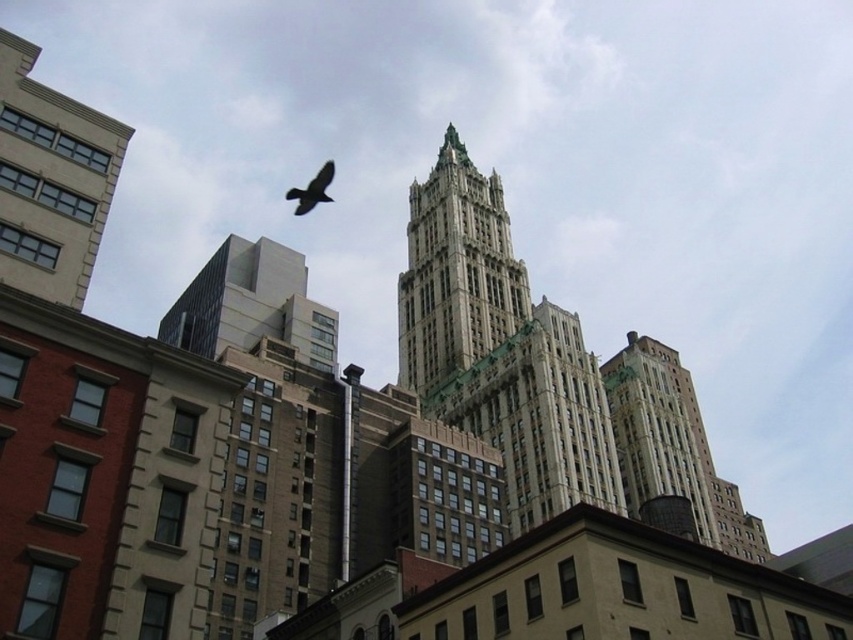
Question: Which point is farther from the camera taking this photo?

Choices:
 (A) (289, 189)
 (B) (431, 250)
 (C) (20, 241)

Answer: (A)

Question: Which object is farther from the camera taking this photo?

Choices:
 (A) beige stone building at left
 (B) gray concrete building at upper left
 (C) gray stone tower at center
 (D) shiny black bird at upper center

Answer: (D)

Question: Is beige stone building at left bigger than gray concrete building at upper left?

Choices:
 (A) yes
 (B) no

Answer: (B)

Question: Considering the real-world distances, which object is closest to the beige stone building at left?

Choices:
 (A) shiny black bird at upper center
 (B) gray concrete building at upper left
 (C) gray stone tower at center

Answer: (B)

Question: Is gray stone tower at center positioned in front of gray concrete building at upper left?

Choices:
 (A) yes
 (B) no

Answer: (B)

Question: Is beige stone building at left below shiny black bird at upper center?

Choices:
 (A) yes
 (B) no

Answer: (A)